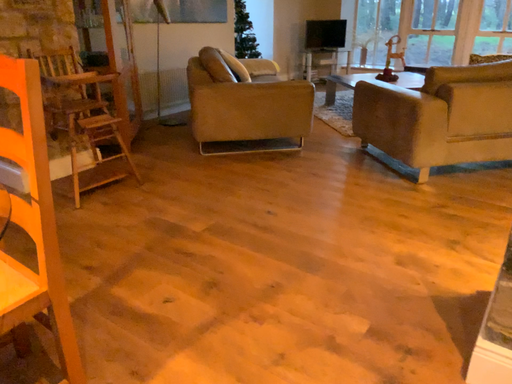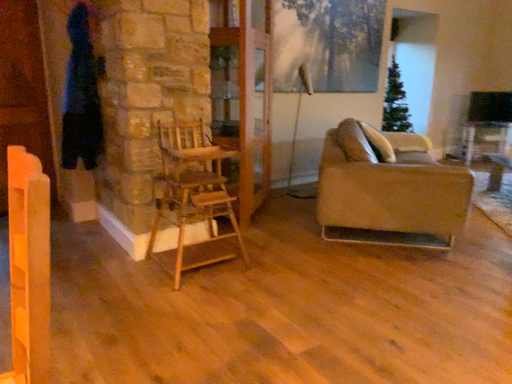
Question: Which way did the camera rotate in the video?

Choices:
 (A) rotated downward
 (B) rotated upward

Answer: (B)